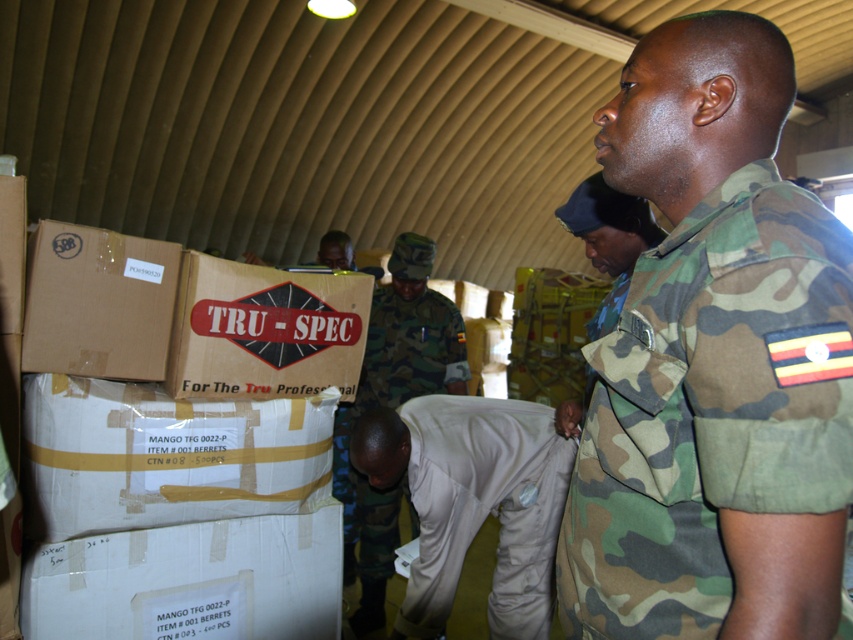
Question: Does white cardboard box at lower left have a larger size compared to tan cotton pants at lower center?

Choices:
 (A) yes
 (B) no

Answer: (A)

Question: Which point is farther from the camera taking this photo?

Choices:
 (A) (698, 320)
 (B) (524, 529)
 (C) (120, 458)
 (D) (171, 340)

Answer: (B)

Question: Considering the relative positions of white cardboard box at lower left and matte brown cardboard box at center in the image provided, where is white cardboard box at lower left located with respect to matte brown cardboard box at center?

Choices:
 (A) left
 (B) right

Answer: (A)

Question: Among these objects, which one is farthest from the camera?

Choices:
 (A) white cardboard box at lower left
 (B) white cardboard box at center
 (C) tan cotton pants at lower center

Answer: (C)

Question: Which of the following is the farthest from the observer?

Choices:
 (A) (401, 362)
 (B) (251, 452)
 (C) (195, 324)

Answer: (A)

Question: In this image, where is white cardboard box at center located relative to white cardboard box at lower left?

Choices:
 (A) left
 (B) right

Answer: (A)